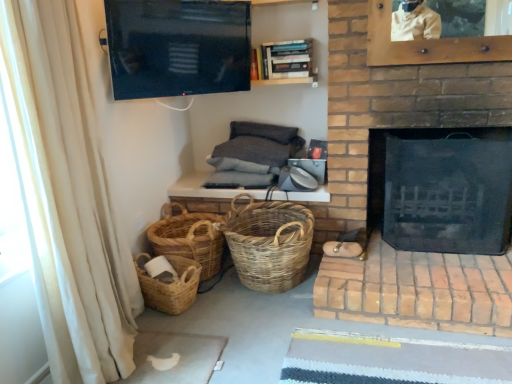
Where is `free space in front of woven natural basket at lower left, positioned as the third basket in right-to-left order`? free space in front of woven natural basket at lower left, positioned as the third basket in right-to-left order is located at coordinates (154, 326).